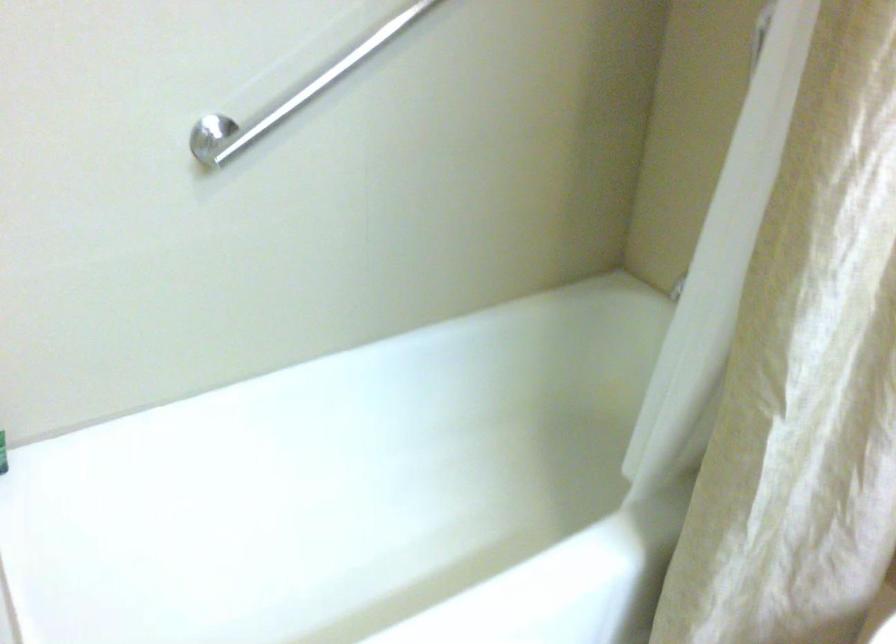
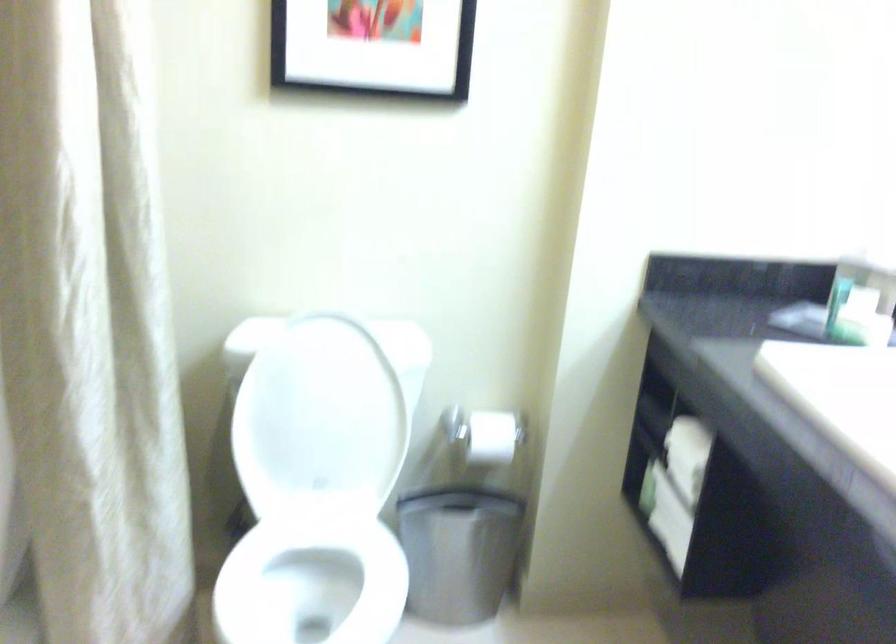
Question: The camera is either moving clockwise (left) or counter-clockwise (right) around the object. The first image is from the beginning of the video and the second image is from the end. Is the camera moving left or right when shooting the video?

Choices:
 (A) Left
 (B) Right

Answer: (A)